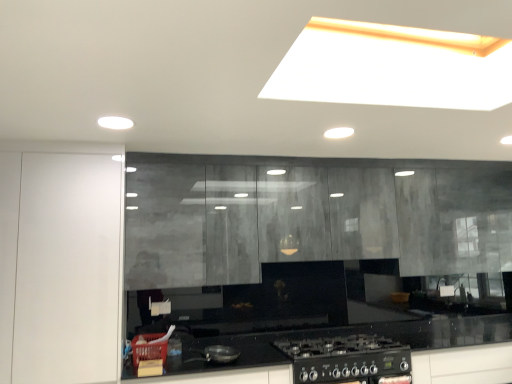
The width and height of the screenshot is (512, 384). Identify the location of matte concrete cabinets at center. pyautogui.click(x=314, y=215).

What do you see at coordinates (314, 215) in the screenshot?
I see `matte concrete cabinets at center` at bounding box center [314, 215].

In order to click on white glossy cabinet at left in this screenshot , I will do `click(59, 267)`.

Image resolution: width=512 pixels, height=384 pixels. Describe the element at coordinates (59, 267) in the screenshot. I see `white glossy cabinet at left` at that location.

What is the approximate width of white glossy cabinet at left?

The width of white glossy cabinet at left is 23.71 inches.

The image size is (512, 384). What are the coordinates of `matte concrete cabinets at center` in the screenshot? It's located at (314, 215).

In the scene shown: Does white glossy cabinet at left appear on the right side of matte concrete cabinets at center?

No, white glossy cabinet at left is not to the right of matte concrete cabinets at center.

Is white glossy cabinet at left closer to the viewer compared to matte concrete cabinets at center?

Yes, it is.

Is point (56, 338) closer or farther from the camera than point (145, 160)?

Clearly, point (56, 338) is closer to the camera than point (145, 160).

In the scene shown: From the image's perspective, which one is positioned lower, white glossy cabinet at left or matte concrete cabinets at center?

white glossy cabinet at left.

From a real-world perspective, which is physically above, white glossy cabinet at left or matte concrete cabinets at center?

In real-world perspective, matte concrete cabinets at center is above.

Does white glossy cabinet at left have a lesser width compared to matte concrete cabinets at center?

No, white glossy cabinet at left is not thinner than matte concrete cabinets at center.

Who is shorter, white glossy cabinet at left or matte concrete cabinets at center?

matte concrete cabinets at center.

Considering the relative sizes of white glossy cabinet at left and matte concrete cabinets at center in the image provided, is white glossy cabinet at left bigger than matte concrete cabinets at center?

No.

Is white glossy cabinet at left positioned beyond the bounds of matte concrete cabinets at center?

Yes, white glossy cabinet at left is located beyond the bounds of matte concrete cabinets at center.

Is white glossy cabinet at left in contact with matte concrete cabinets at center?

white glossy cabinet at left is not next to matte concrete cabinets at center, and they're not touching.

Is white glossy cabinet at left aimed at matte concrete cabinets at center?

No.

What's the angular difference between white glossy cabinet at left and matte concrete cabinets at center's facing directions?

white glossy cabinet at left and matte concrete cabinets at center are facing 0.456 degrees away from each other.

In the scene shown: How far apart are white glossy cabinet at left and matte concrete cabinets at center?

white glossy cabinet at left and matte concrete cabinets at center are 98.32 centimeters apart.

Locate an element on the screen. glass door located on the left of matte concrete cabinets at center is located at coordinates (59, 267).

Between matte concrete cabinets at center and white glossy cabinet at left, which one appears on the right side from the viewer's perspective?

From the viewer's perspective, matte concrete cabinets at center appears more on the right side.

Which is in front, matte concrete cabinets at center or white glossy cabinet at left?

white glossy cabinet at left.

Considering the positions of point (285, 165) and point (50, 253), is point (285, 165) closer or farther from the camera than point (50, 253)?

Point (285, 165) appears to be farther away from the viewer than point (50, 253).

From the image's perspective, is matte concrete cabinets at center under white glossy cabinet at left?

Actually, matte concrete cabinets at center appears above white glossy cabinet at left in the image.

From a real-world perspective, is matte concrete cabinets at center positioned over white glossy cabinet at left based on gravity?

Correct, in the physical world, matte concrete cabinets at center is higher than white glossy cabinet at left.

Is matte concrete cabinets at center thinner than white glossy cabinet at left?

Yes.

Considering the relative sizes of matte concrete cabinets at center and white glossy cabinet at left in the image provided, is matte concrete cabinets at center shorter than white glossy cabinet at left?

Indeed, matte concrete cabinets at center has a lesser height compared to white glossy cabinet at left.

Considering the sizes of objects matte concrete cabinets at center and white glossy cabinet at left in the image provided, who is bigger, matte concrete cabinets at center or white glossy cabinet at left?

Bigger between the two is matte concrete cabinets at center.

Is white glossy cabinet at left surrounded by matte concrete cabinets at center?

No, white glossy cabinet at left is not a part of matte concrete cabinets at center.

Is the surface of matte concrete cabinets at center in direct contact with white glossy cabinet at left?

No, matte concrete cabinets at center is not touching white glossy cabinet at left.

Is matte concrete cabinets at center oriented away from white glossy cabinet at left?

No, white glossy cabinet at left is not at the back of matte concrete cabinets at center.

What's the angular difference between matte concrete cabinets at center and white glossy cabinet at left's facing directions?

The angular difference between matte concrete cabinets at center and white glossy cabinet at left is 0.456 degrees.

At what (x,y) coordinates should I click in order to perform the action: click on cabinetry above the white glossy cabinet at left (from a real-world perspective). Please return your answer as a coordinate pair (x, y). This screenshot has height=384, width=512. Looking at the image, I should click on (314, 215).

What are the coordinates of `cabinetry on the right of white glossy cabinet at left` in the screenshot? It's located at click(314, 215).

The height and width of the screenshot is (384, 512). Identify the location of glass door directly beneath the matte concrete cabinets at center (from a real-world perspective). (59, 267).